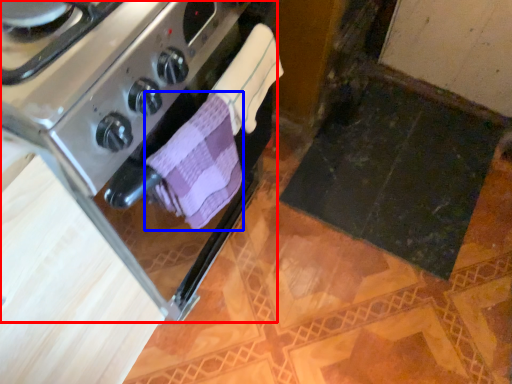
Question: Which object appears closest to the camera in this image, kitchen appliance (highlighted by a red box) or bath towel (highlighted by a blue box)?

Choices:
 (A) kitchen appliance
 (B) bath towel

Answer: (A)